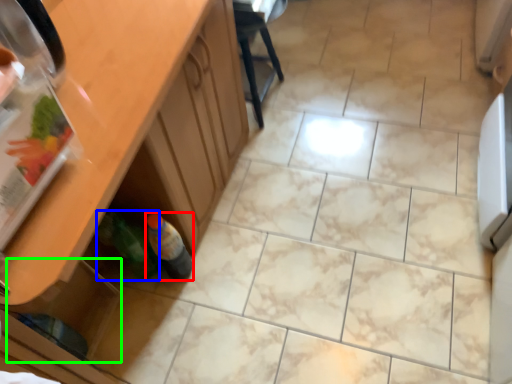
Question: Which object is positioned farthest from bottle (highlighted by a red box)? Select from bottle (highlighted by a blue box) and drawer (highlighted by a green box).

Choices:
 (A) bottle
 (B) drawer

Answer: (B)